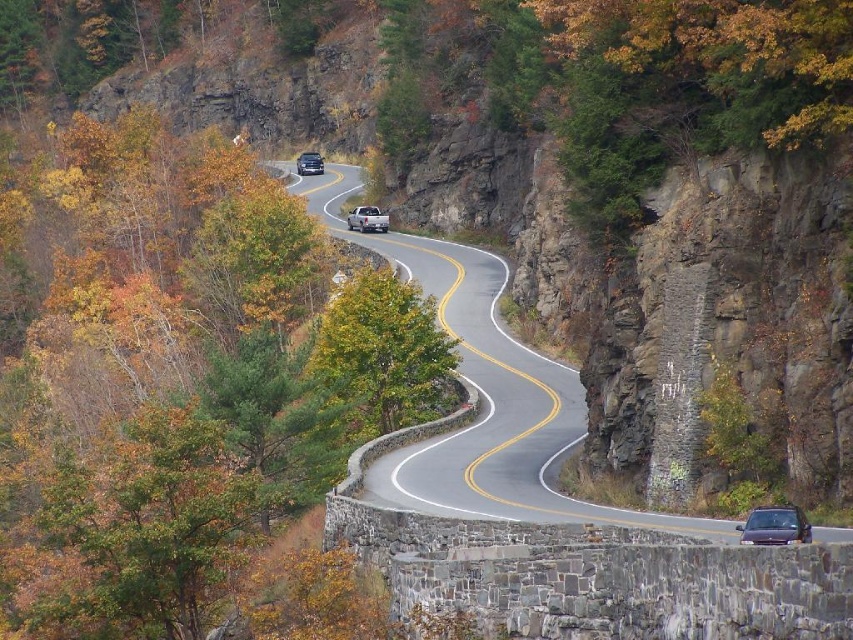
Question: In this image, where is metallic purple sedan at lower right located relative to satin silver truck at center?

Choices:
 (A) below
 (B) above

Answer: (A)

Question: Estimate the real-world distances between objects in this image. Which object is farther from the smooth asphalt road at center?

Choices:
 (A) satin black suv at center
 (B) metallic purple sedan at lower right
 (C) satin silver truck at center

Answer: (A)

Question: Which of the following is the farthest from the observer?

Choices:
 (A) satin black suv at center
 (B) satin silver truck at center

Answer: (A)

Question: Based on their relative distances, which object is nearer to the satin black suv at center?

Choices:
 (A) metallic purple sedan at lower right
 (B) satin silver truck at center
 (C) smooth asphalt road at center

Answer: (C)

Question: Does metallic purple sedan at lower right come behind satin black suv at center?

Choices:
 (A) no
 (B) yes

Answer: (A)

Question: In this image, where is satin silver truck at center located relative to satin black suv at center?

Choices:
 (A) right
 (B) left

Answer: (A)